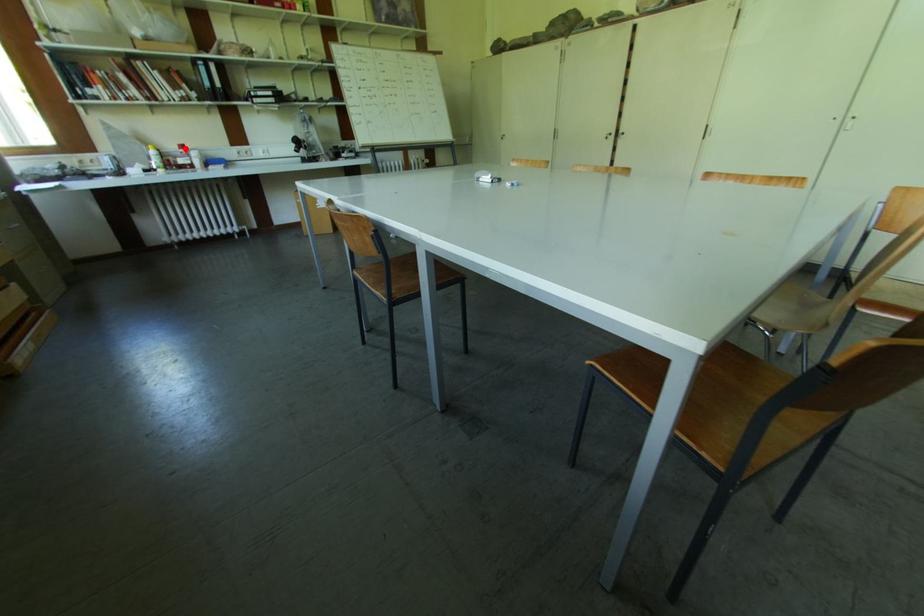
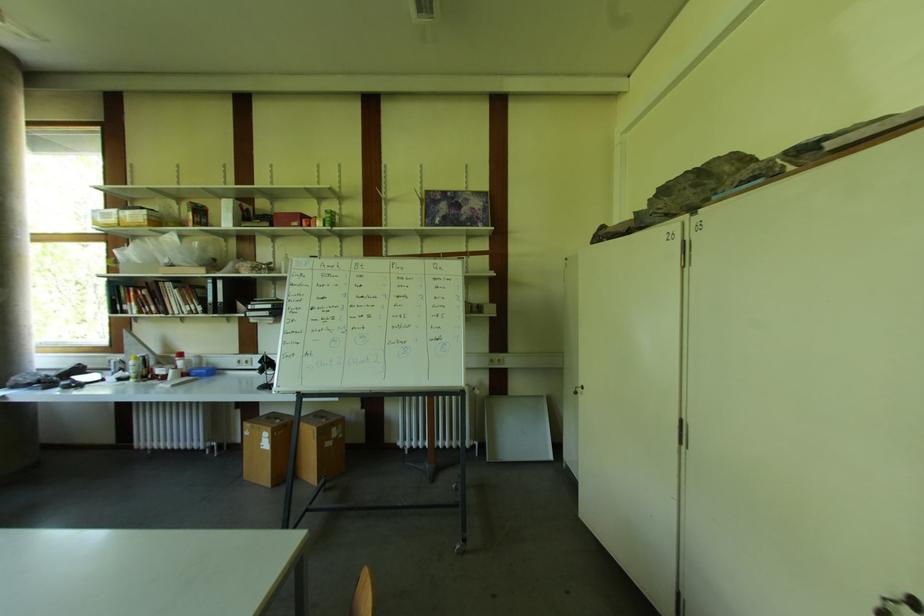
Where in the second image is the point corresponding to the highlighted location from the first image?

(184, 357)